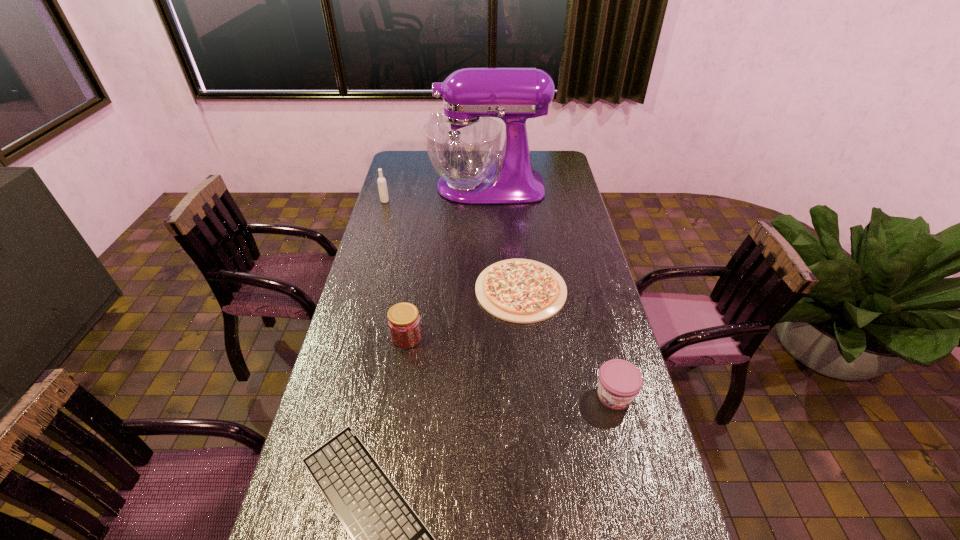
Find the location of a particular element. The image size is (960, 540). the tallest object is located at coordinates click(x=463, y=144).

Where is `the second tallest object`? Image resolution: width=960 pixels, height=540 pixels. the second tallest object is located at coordinates (382, 185).

Locate an element on the screen. the farther jam is located at coordinates (404, 323).

Find the location of a particular element. Image resolution: width=960 pixels, height=540 pixels. the left jam is located at coordinates (404, 323).

You are a GUI agent. You are given a task and a screenshot of the screen. Output one action in this format:
    pyautogui.click(x=<x>, y=<y>)
    Task: Click on the nearer jam
    Image resolution: width=960 pixels, height=540 pixels.
    Given the screenshot: What is the action you would take?
    pyautogui.click(x=620, y=381)

Where is `the shorter jam`? The width and height of the screenshot is (960, 540). the shorter jam is located at coordinates (620, 381).

Locate an element on the screen. The image size is (960, 540). the second shortest object is located at coordinates (523, 291).

Locate an element on the screen. The height and width of the screenshot is (540, 960). the fourth nearest object is located at coordinates (523, 291).

Where is `free space located at the bowl opening of the tallest object`? This screenshot has height=540, width=960. free space located at the bowl opening of the tallest object is located at coordinates (393, 187).

Where is `free space located at the bowl opening of the tallest object`? The height and width of the screenshot is (540, 960). free space located at the bowl opening of the tallest object is located at coordinates (407, 187).